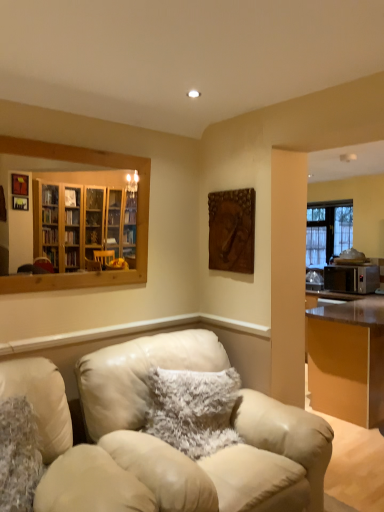
You are a GUI agent. You are given a task and a screenshot of the screen. Output one action in this format:
    pyautogui.click(x=<x>, y=<y>)
    Task: Click on the satin silver microwave at right
    Image resolution: width=384 pixels, height=512 pixels.
    Given the screenshot: What is the action you would take?
    click(352, 278)

At what (x,y) coordinates should I click in order to perform the action: click on brown textured plaque at upper center. Please return your answer as a coordinate pair (x, y). The width and height of the screenshot is (384, 512). Looking at the image, I should click on (232, 230).

This screenshot has width=384, height=512. What do you see at coordinates (192, 409) in the screenshot?
I see `fuzzy white pillow at center, which is counted as the second pillow, starting from the left` at bounding box center [192, 409].

In the scene shown: What is the approximate width of leather chair at center?

The width of leather chair at center is 3.38 feet.

Identify the location of wooden frame mirror at upper left. (92, 164).

Image resolution: width=384 pixels, height=512 pixels. What do you see at coordinates (188, 462) in the screenshot?
I see `leather couch at center` at bounding box center [188, 462].

Where is `satin silver microwave at right`? The height and width of the screenshot is (512, 384). satin silver microwave at right is located at coordinates (352, 278).

From the image's perspective, who appears lower, metallic brown desk at right or fuzzy white pillow at center, placed as the 1th pillow when sorted from back to front?

metallic brown desk at right.

Are metallic brown desk at right and fuzzy white pillow at center, arranged as the 1th pillow when viewed from the right, far apart?

metallic brown desk at right is far away from fuzzy white pillow at center, arranged as the 1th pillow when viewed from the right.

Considering the relative sizes of metallic brown desk at right and fuzzy white pillow at center, arranged as the 1th pillow when viewed from the right, in the image provided, is metallic brown desk at right wider than fuzzy white pillow at center, arranged as the 1th pillow when viewed from the right,?

Yes.

From a real-world perspective, which object rests below the other?

From a 3D spatial view, metallic brown desk at right is below.

From the image's perspective, which one is positioned higher, leather couch at center or fuzzy fabric pillow at lower left, the second pillow positioned from the right?

fuzzy fabric pillow at lower left, the second pillow positioned from the right, appears higher in the image.

Could you tell me if leather couch at center is turned towards fuzzy fabric pillow at lower left, the second pillow positioned from the right?

No, leather couch at center is not oriented towards fuzzy fabric pillow at lower left, the second pillow positioned from the right.

This screenshot has width=384, height=512. What are the coordinates of `studio couch below the fuzzy fabric pillow at lower left, marked as the 1th pillow in a front-to-back arrangement (from a real-world perspective)` in the screenshot? It's located at (188, 462).

Between leather couch at center and fuzzy fabric pillow at lower left, which is the 2th pillow in back-to-front order, which one appears on the left side from the viewer's perspective?

fuzzy fabric pillow at lower left, which is the 2th pillow in back-to-front order, is more to the left.

From a real-world perspective, which object stands above the other?

satin silver microwave at right.

Are satin silver microwave at right and leather chair at center located far from each other?

satin silver microwave at right is positioned a significant distance from leather chair at center.

At what (x,y) coordinates should I click in order to perform the action: click on chair that is in front of the satin silver microwave at right. Please return your answer as a coordinate pair (x, y). This screenshot has height=512, width=384. Looking at the image, I should click on (69, 448).

Which of these two, satin silver microwave at right or leather chair at center, is bigger?

Bigger between the two is leather chair at center.

From the image's perspective, is leather chair at center located above brown textured plaque at upper center?

Incorrect, from the image's perspective, leather chair at center is lower than brown textured plaque at upper center.

How many degrees apart are the facing directions of leather chair at center and brown textured plaque at upper center?

They differ by 90.2 degrees in their facing directions.

Considering the positions of point (87, 447) and point (215, 204), is point (87, 447) closer or farther from the camera than point (215, 204)?

Point (87, 447) appears to be closer to the viewer than point (215, 204).

Considering the relative positions of leather chair at center and satin silver microwave at right in the image provided, is leather chair at center to the left of satin silver microwave at right from the viewer's perspective?

Yes, leather chair at center is to the left of satin silver microwave at right.

Could you tell me if leather chair at center is turned towards satin silver microwave at right?

No, leather chair at center is not aimed at satin silver microwave at right.

Is leather chair at center further to the viewer compared to satin silver microwave at right?

No, it is not.

From the image's perspective, who appears lower, leather chair at center or satin silver microwave at right?

leather chair at center is shown below in the image.

Is leather chair at center taller or shorter than leather couch at center?

Clearly, leather chair at center is shorter compared to leather couch at center.

Which is closer to the camera, [135,493] or [321,488]?

Point [135,493] is closer to the camera than point [321,488].

Considering the positions of objects leather chair at center and leather couch at center in the image provided, who is behind, leather chair at center or leather couch at center?

leather couch at center.

From the image's perspective, between leather chair at center and leather couch at center, which one is located above?

leather chair at center is shown above in the image.

Does leather couch at center have a smaller size compared to satin silver microwave at right?

No.

The height and width of the screenshot is (512, 384). In order to click on microwave oven that appears on the right of leather couch at center in this screenshot , I will do `click(352, 278)`.

Is leather couch at center to the left of satin silver microwave at right from the viewer's perspective?

Yes, leather couch at center is to the left of satin silver microwave at right.

Which is in front, point (274, 448) or point (356, 285)?

The point (274, 448) is in front.

From the metallic brown desk at right, count 1st pillows forward and point to it. Please provide its 2D coordinates.

[(192, 409)]

I want to click on the 1st pillow positioned above the leather couch at center (from a real-world perspective), so click(x=18, y=455).

Looking at the image, which one is located further to leather chair at center, brown textured plaque at upper center or metallic brown desk at right?

metallic brown desk at right is positioned further to the anchor leather chair at center.

Looking at the image, which one is located further to brown textured plaque at upper center, wooden frame mirror at upper left or satin silver microwave at right?

satin silver microwave at right is positioned further to the anchor brown textured plaque at upper center.

Estimate the real-world distances between objects in this image. Which object is further from brown textured plaque at upper center, fuzzy fabric pillow at lower left, which is the 2th pillow in back-to-front order, or metallic brown desk at right?

metallic brown desk at right is positioned further to the anchor brown textured plaque at upper center.

Which object lies further to the anchor point leather couch at center, leather chair at center or brown textured plaque at upper center?

The object further to leather couch at center is brown textured plaque at upper center.

Based on their spatial positions, is leather couch at center or brown textured plaque at upper center closer to fuzzy white pillow at center, which is counted as the second pillow, starting from the left?

leather couch at center.

Which object lies nearer to the anchor point brown textured plaque at upper center, metallic brown desk at right or fuzzy white pillow at center, placed as the 1th pillow when sorted from back to front?

The object closer to brown textured plaque at upper center is fuzzy white pillow at center, placed as the 1th pillow when sorted from back to front.

Estimate the real-world distances between objects in this image. Which object is further from leather chair at center, fuzzy white pillow at center, marked as the 2th pillow in a front-to-back arrangement, or fuzzy fabric pillow at lower left, the 1th pillow in the left-to-right sequence?

fuzzy white pillow at center, marked as the 2th pillow in a front-to-back arrangement, lies further to leather chair at center than the other object.

Considering their positions, is fuzzy fabric pillow at lower left, the second pillow positioned from the right, positioned further to leather couch at center than leather chair at center?

fuzzy fabric pillow at lower left, the second pillow positioned from the right, is positioned further to the anchor leather couch at center.

Image resolution: width=384 pixels, height=512 pixels. I want to click on studio couch located between fuzzy fabric pillow at lower left, the 1th pillow in the left-to-right sequence, and metallic brown desk at right in the left-right direction, so click(188, 462).

Find the location of a particular element. This screenshot has width=384, height=512. picture frame between fuzzy fabric pillow at lower left, the 1th pillow in the left-to-right sequence, and metallic brown desk at right, in the horizontal direction is located at coordinates (232, 230).

This screenshot has width=384, height=512. In order to click on picture frame between wooden frame mirror at upper left and fuzzy fabric pillow at lower left, which is the 2th pillow in back-to-front order, in the up-down direction in this screenshot , I will do `click(232, 230)`.

Image resolution: width=384 pixels, height=512 pixels. What are the coordinates of `picture frame located between leather couch at center and satin silver microwave at right in the depth direction` in the screenshot? It's located at (232, 230).